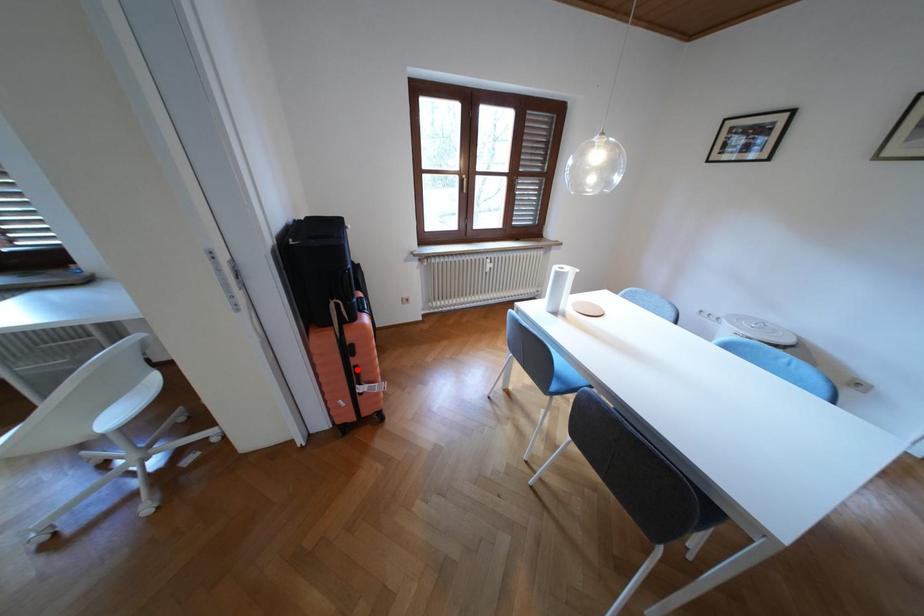
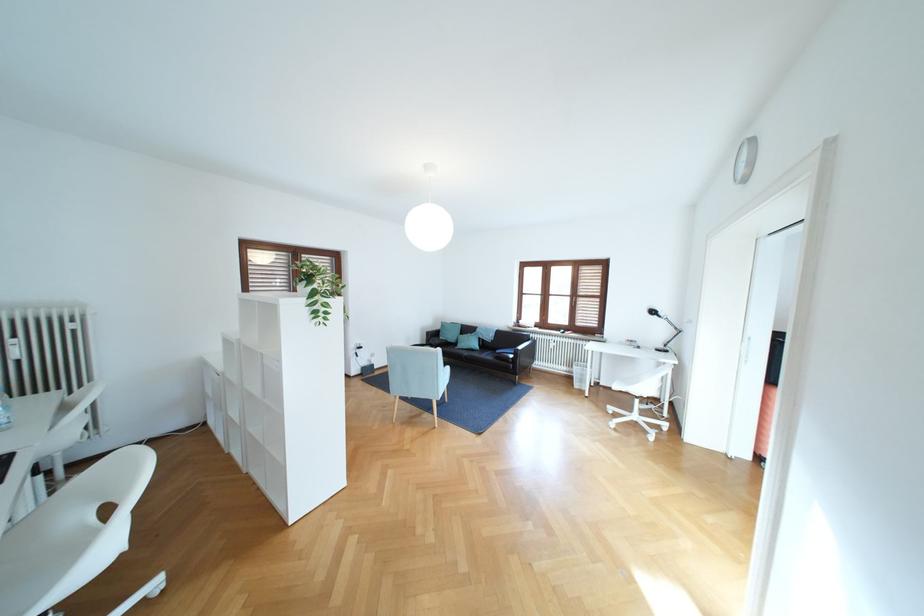
Question: I am providing you with two images of the same scene from different viewpoints. A red point is marked on the first image. Can you still see the location of the red point in image 2?

Choices:
 (A) Yes
 (B) No

Answer: (B)